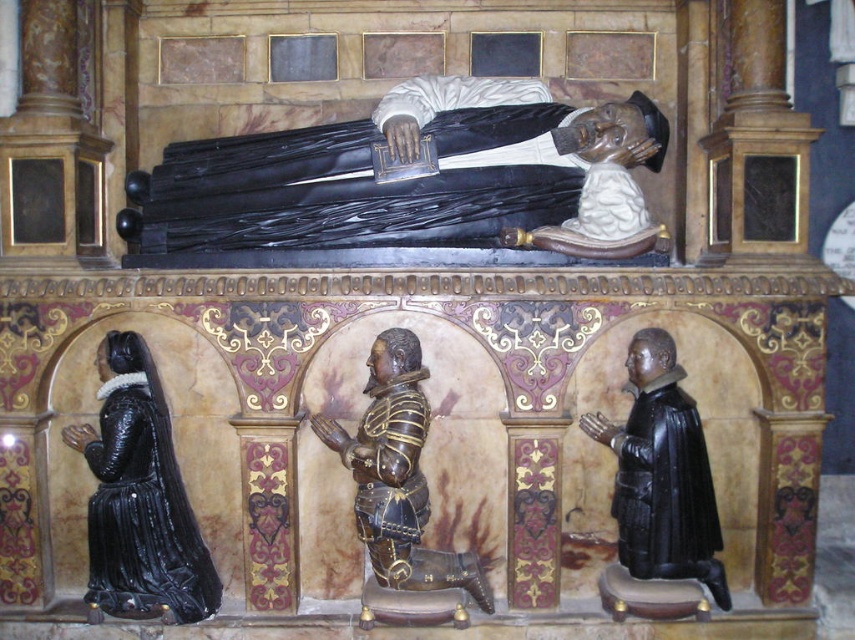
Does matte black statue at center have a greater height compared to black polished wood statue at center?

Incorrect, matte black statue at center's height is not larger of black polished wood statue at center's.

Is matte black statue at center below black polished wood statue at center?

Actually, matte black statue at center is above black polished wood statue at center.

Find the location of a particular element. The image size is (855, 640). matte black statue at center is located at coordinates (349, 192).

Is black polished wood statue at center in front of bronze armor at center?

No, black polished wood statue at center is behind bronze armor at center.

Who is taller, black polished wood statue at center or bronze armor at center?

bronze armor at center is taller.

Does point (716, 508) come in front of point (369, 516)?

No.

The width and height of the screenshot is (855, 640). What are the coordinates of `black polished wood statue at center` in the screenshot? It's located at (661, 474).

Who is positioned more to the left, black glossy statue at lower left or bronze armor at center?

black glossy statue at lower left is more to the left.

Can you confirm if black glossy statue at lower left is shorter than bronze armor at center?

No, black glossy statue at lower left is not shorter than bronze armor at center.

The height and width of the screenshot is (640, 855). What do you see at coordinates (139, 499) in the screenshot?
I see `black glossy statue at lower left` at bounding box center [139, 499].

You are a GUI agent. You are given a task and a screenshot of the screen. Output one action in this format:
    pyautogui.click(x=<x>, y=<y>)
    Task: Click on the black glossy statue at lower left
    This screenshot has width=855, height=640.
    Given the screenshot: What is the action you would take?
    pyautogui.click(x=139, y=499)